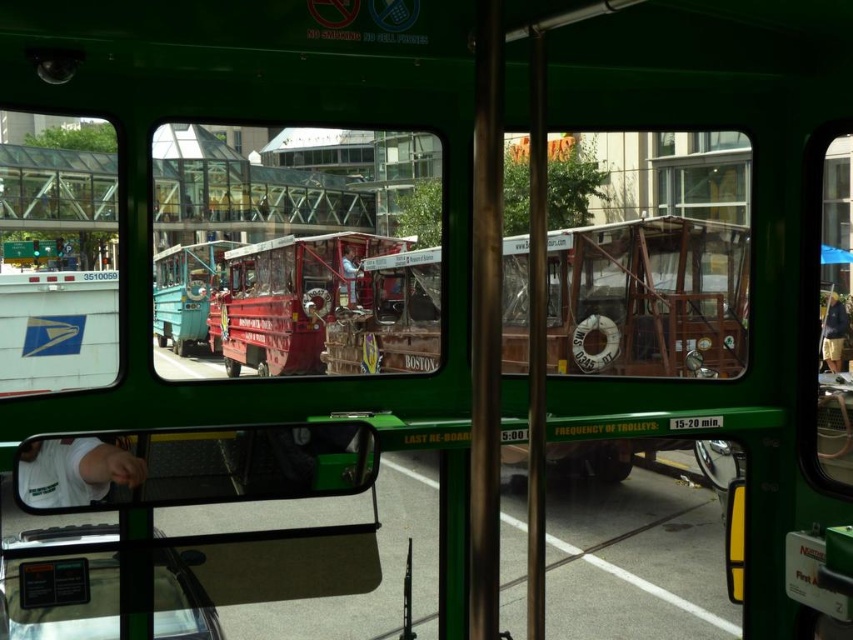
You are a passenger on the trolley and want to take a photo of the rusty wood decker bus at center through the window. Where should you position yourself to capture it best?

The rusty wood decker bus at center is located at point (647, 298), so you should position yourself near the center of the trolley to capture it best.

You are a passenger on the shiny red trolley at center and want to look at the rusty wood decker bus at center through the window. Can you see it from your current position?

The rusty wood decker bus at center is further to the viewer than the shiny red trolley at center, so the passenger on the shiny red trolley at center cannot see the rusty wood decker bus at center through the window because it is closer to the viewer and would block the view.